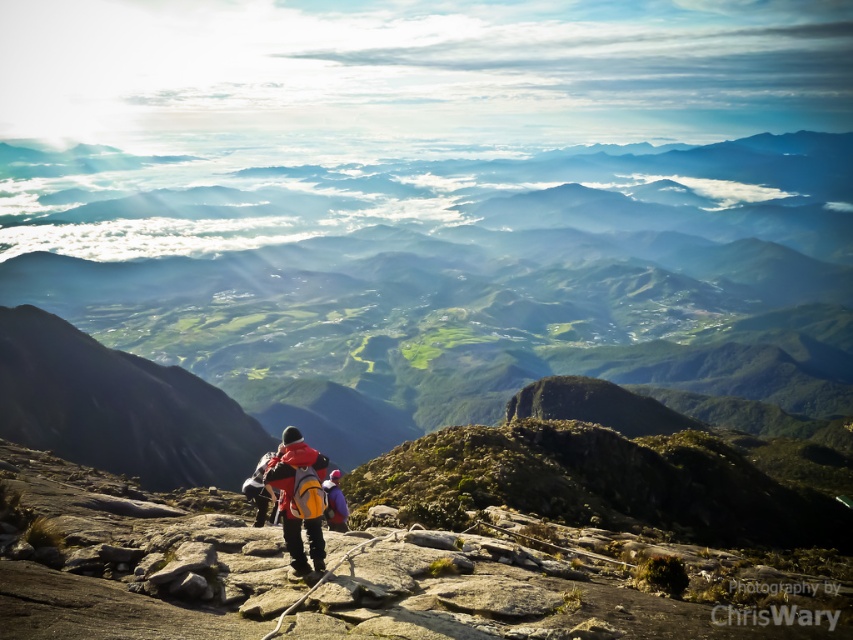
Does matte orange backpack at center appear over matte blue jacket at center?

A: Indeed, matte orange backpack at center is positioned over matte blue jacket at center.

Is point (288, 493) less distant than point (331, 492)?

Yes, it is.

The height and width of the screenshot is (640, 853). Find the location of `matte orange backpack at center`. matte orange backpack at center is located at coordinates (292, 497).